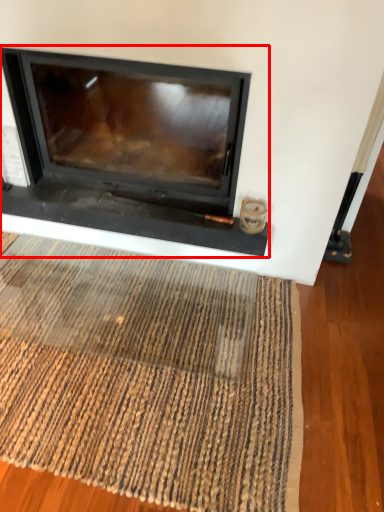
Question: From the image's perspective, considering the relative positions of fireplace (annotated by the red box) and mat in the image provided, where is fireplace (annotated by the red box) located with respect to the staircase?

Choices:
 (A) above
 (B) below

Answer: (A)